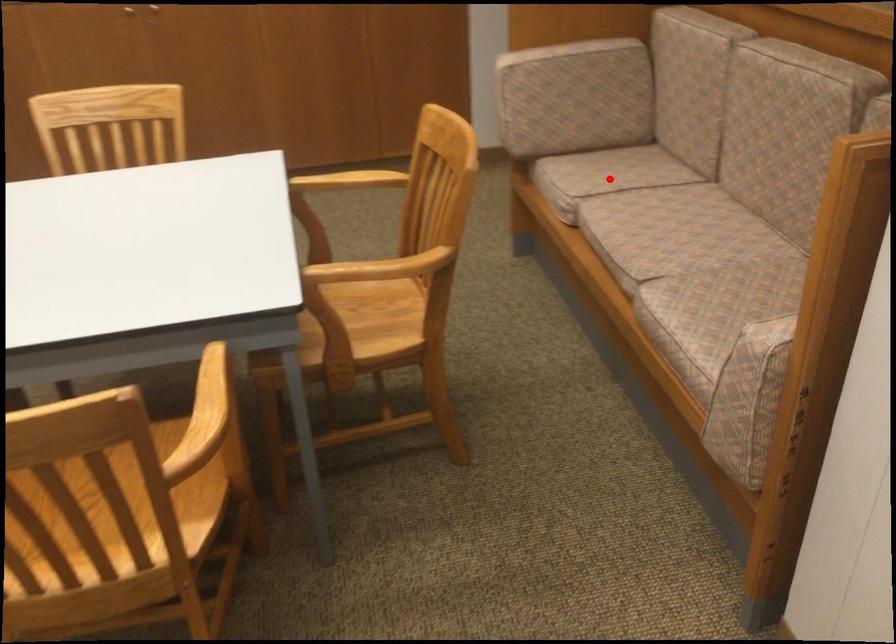
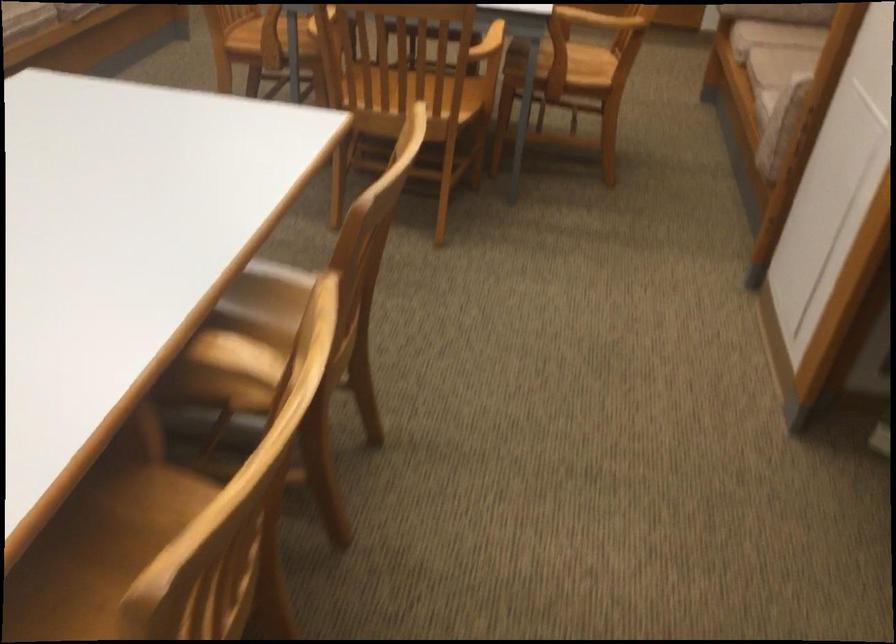
Question: I am providing you with two images of the same scene from different viewpoints. A red point is marked on the first image. At the location where the point appears in image 1, is it still visible in image 2?

Choices:
 (A) Yes
 (B) No

Answer: (A)